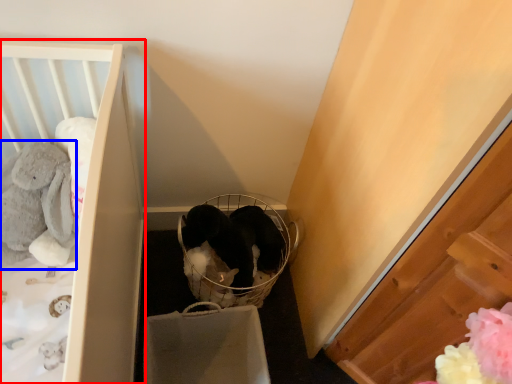
Question: Among these objects, which one is nearest to the camera, furniture (highlighted by a red box) or animal (highlighted by a blue box)?

Choices:
 (A) furniture
 (B) animal

Answer: (A)